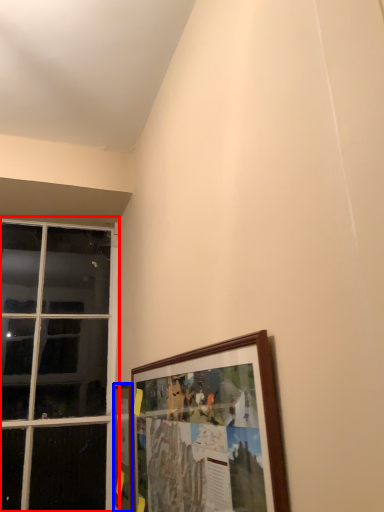
Question: Which of the following is the closest to the observer, window (highlighted by a red box) or picture frame (highlighted by a blue box)?

Choices:
 (A) window
 (B) picture frame

Answer: (B)